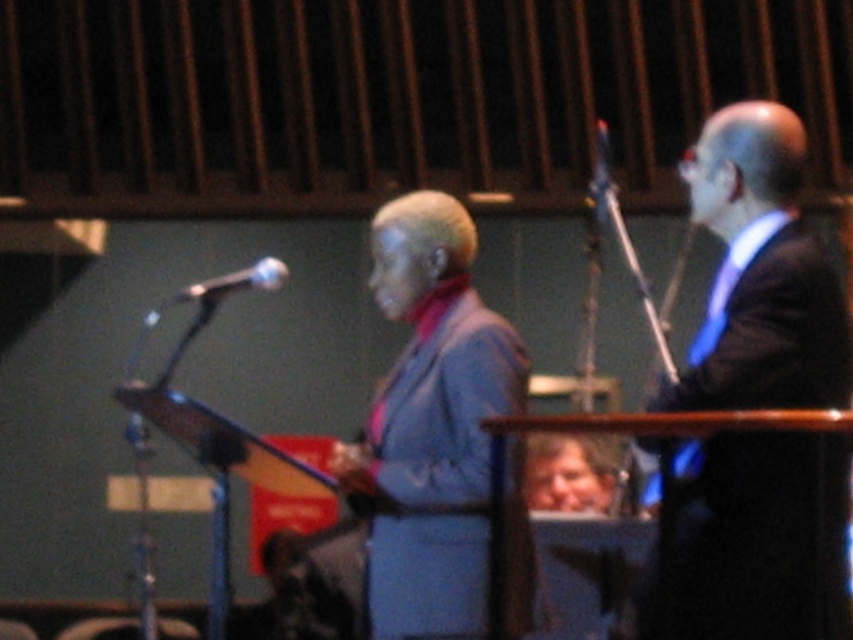
You are an event organizer and need to arrange seating for the speakers. The dark blue suit at right and the matte blue suit at center are both speakers. According to their current positions, which speaker should sit on the left side of the stage to maintain their relative positioning?

The matte blue suit at center should sit on the left side of the stage because the dark blue suit at right is currently positioned to the right of it, so maintaining that order would place the matte blue suit at center on the left and the dark blue suit at right on the right.

You are organizing a photo shoot and need to position two subjects in the scene. The first subject is wearing a dark blue suit at right, and the second is near the matte silver microphone at left. What is the minimum distance in feet you should maintain between them to ensure they are positioned as in the original image?

The minimum distance you should maintain between the dark blue suit at right and the matte silver microphone at left is 10.53 feet to match their positions in the original image.

You are standing at the center of the stage and need to quickly move to the dark blue suit at right. According to the coordinates provided, in which direction should you move first?

The dark blue suit at right is located at coordinates 0.430 on the x and 0.892 on the y. Since you are at the center, you should move to the right and forward to reach it.